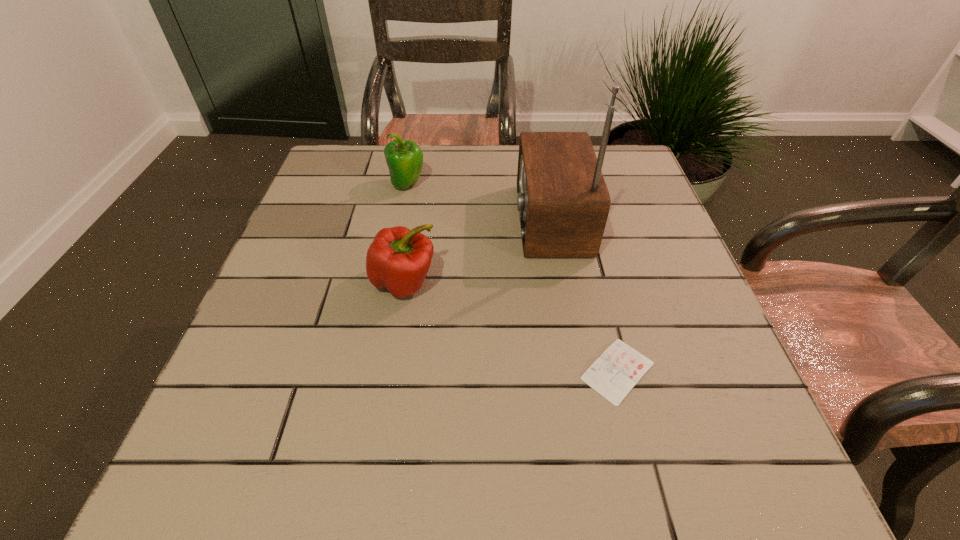
In the image, there is a desktop. Where is `vacant space at the far left corner`? Image resolution: width=960 pixels, height=540 pixels. vacant space at the far left corner is located at coordinates (352, 160).

The height and width of the screenshot is (540, 960). Find the location of `vacant area at the near right corner`. vacant area at the near right corner is located at coordinates (714, 467).

Image resolution: width=960 pixels, height=540 pixels. I want to click on empty space between the radio receiver and the farther bell pepper, so click(x=479, y=202).

Identify the location of unoccupied position between the nearer bell pepper and the shortest object. (511, 327).

Where is `free spot between the tallest object and the nearer bell pepper`? The width and height of the screenshot is (960, 540). free spot between the tallest object and the nearer bell pepper is located at coordinates (477, 251).

The image size is (960, 540). I want to click on free spot between the nearest object and the nearer bell pepper, so click(511, 327).

Locate an element on the screen. This screenshot has width=960, height=540. blank region between the nearest object and the second shortest object is located at coordinates (511, 327).

The height and width of the screenshot is (540, 960). Find the location of `free area in between the shorter bell pepper and the shortest object`. free area in between the shorter bell pepper and the shortest object is located at coordinates (511, 327).

Identify the location of free space between the radio receiver and the third tallest object. This screenshot has width=960, height=540. (477, 251).

Where is `free space between the farther bell pepper and the nearest object`? free space between the farther bell pepper and the nearest object is located at coordinates (513, 278).